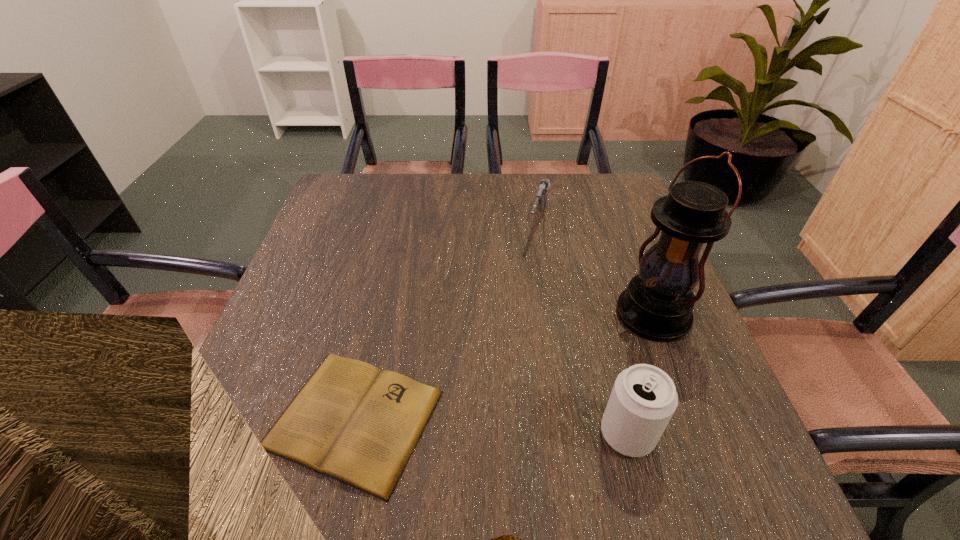
Identify the location of the leftmost object. The image size is (960, 540). point(351,421).

You are a GUI agent. You are given a task and a screenshot of the screen. Output one action in this format:
    pyautogui.click(x=<x>, y=<y>)
    Task: Click on the book
    This screenshot has width=960, height=540.
    Given the screenshot: What is the action you would take?
    pyautogui.click(x=351, y=421)

Find the location of `can`. can is located at coordinates (643, 399).

Locate an element on the screen. lantern is located at coordinates (657, 305).

Locate an element on the screen. The height and width of the screenshot is (540, 960). the tallest object is located at coordinates (657, 305).

Locate an element on the screen. The height and width of the screenshot is (540, 960). gun is located at coordinates (541, 199).

This screenshot has height=540, width=960. What are the coordinates of `the farthest object` in the screenshot? It's located at (541, 199).

Where is `vacant space located on the right of the leftmost object`? vacant space located on the right of the leftmost object is located at coordinates (502, 418).

Image resolution: width=960 pixels, height=540 pixels. In order to click on free space located 0.150m on the left of the can in this screenshot , I will do `click(516, 434)`.

Find several locations within the vacant space located 0.130m above the tallest object, indicating its light source. Please provide its 2D coordinates. Your answer should be formatted as a tuple, i.e. [(x, y)], where the tuple contains the x and y coordinates of a point satisfying the conditions above.

[(578, 354)]